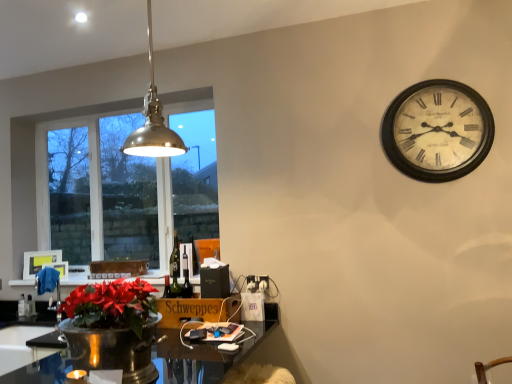
Question: Is white plastic power outlet at lower center positioned behind wooden schweppes at lower center, arranged as the 2th cardboard box when viewed from the back?

Choices:
 (A) yes
 (B) no

Answer: (A)

Question: Is wooden schweppes at lower center, arranged as the 1th cardboard box when ordered from the bottom, a part of white plastic power outlet at lower center?

Choices:
 (A) no
 (B) yes

Answer: (A)

Question: Does white plastic power outlet at lower center turn towards wooden schweppes at lower center, the 2th cardboard box from the top?

Choices:
 (A) yes
 (B) no

Answer: (B)

Question: Does white plastic power outlet at lower center appear on the right side of wooden schweppes at lower center, which ranks as the second cardboard box in left-to-right order?

Choices:
 (A) yes
 (B) no

Answer: (A)

Question: Considering the relative positions of white plastic power outlet at lower center and wooden schweppes at lower center, the 2th cardboard box from the top, in the image provided, is white plastic power outlet at lower center in front of wooden schweppes at lower center, the 2th cardboard box from the top,?

Choices:
 (A) yes
 (B) no

Answer: (B)

Question: In the image, is matte white picture frame at upper left, positioned as the first picture frame in right-to-left order, positioned in front of or behind white plastic power outlet at lower center?

Choices:
 (A) behind
 (B) front

Answer: (A)

Question: In terms of width, does matte white picture frame at upper left, positioned as the first picture frame in right-to-left order, look wider or thinner when compared to white plastic power outlet at lower center?

Choices:
 (A) thin
 (B) wide

Answer: (B)

Question: Is matte white picture frame at upper left, placed as the 2th picture frame when sorted from left to right, taller or shorter than white plastic power outlet at lower center?

Choices:
 (A) tall
 (B) short

Answer: (A)

Question: Is matte white picture frame at upper left, positioned as the first picture frame in right-to-left order, to the left or to the right of white plastic power outlet at lower center in the image?

Choices:
 (A) right
 (B) left

Answer: (B)

Question: From the image's perspective, is matte white picture frame at upper left, positioned as the first picture frame in right-to-left order, positioned above or below clear glass window at left?

Choices:
 (A) below
 (B) above

Answer: (A)

Question: Does point 64,269 appear closer or farther from the camera than point 30,233?

Choices:
 (A) farther
 (B) closer

Answer: (B)

Question: Is matte white picture frame at upper left, placed as the 2th picture frame when sorted from left to right, in front of or behind clear glass window at left in the image?

Choices:
 (A) front
 (B) behind

Answer: (B)

Question: Is matte white picture frame at upper left, positioned as the first picture frame in right-to-left order, taller or shorter than clear glass window at left?

Choices:
 (A) tall
 (B) short

Answer: (B)

Question: Considering the positions of white plastic power outlet at lower center and wooden schweppes at lower center, which ranks as the second cardboard box in left-to-right order, in the image, is white plastic power outlet at lower center bigger or smaller than wooden schweppes at lower center, which ranks as the second cardboard box in left-to-right order,?

Choices:
 (A) small
 (B) big

Answer: (A)

Question: Do you think white plastic power outlet at lower center is within wooden schweppes at lower center, placed as the first cardboard box when sorted from right to left, or outside of it?

Choices:
 (A) inside
 (B) outside

Answer: (B)